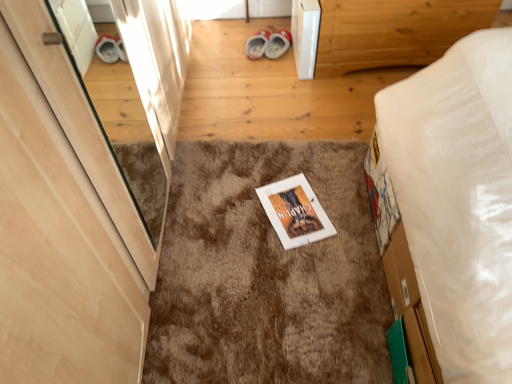
The image size is (512, 384). I want to click on vacant point to the left of red suede shoes at center, so click(x=211, y=41).